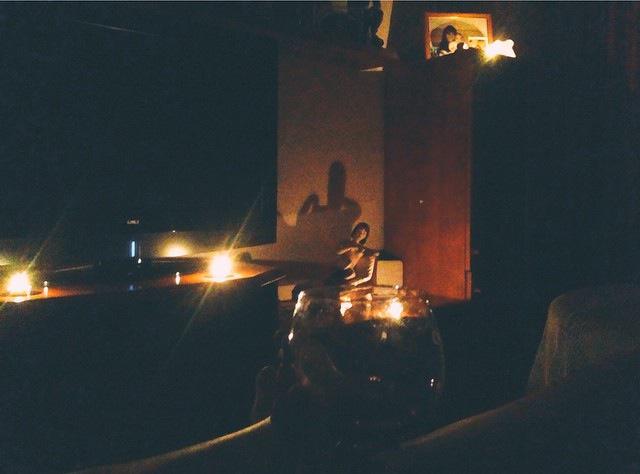
The image size is (640, 474). I want to click on tea candle lft, so click(20, 282).